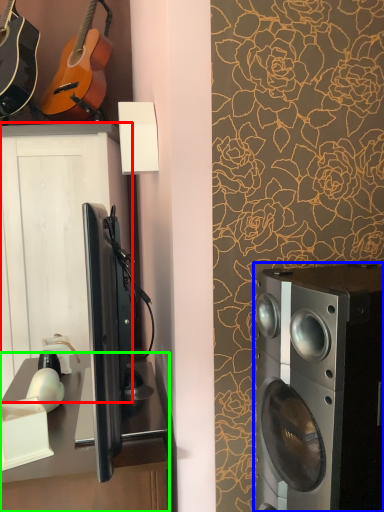
Question: Considering the real-world distances, which object is closest to cabinetry (highlighted by a red box)? home appliance (highlighted by a blue box) or desk (highlighted by a green box).

Choices:
 (A) home appliance
 (B) desk

Answer: (B)